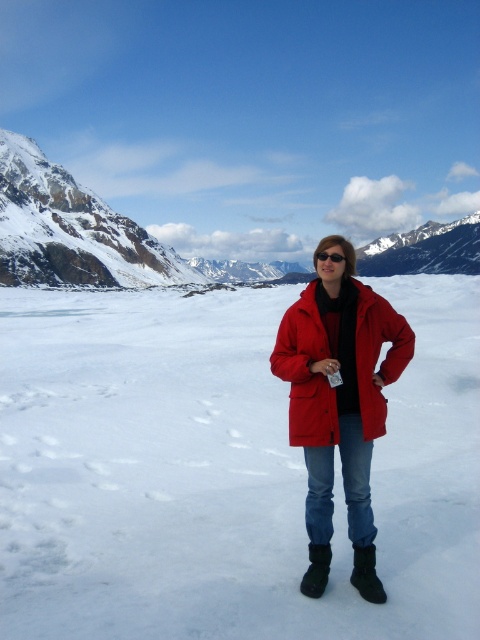
Does snowy rocky mountain at upper left lie behind red plastic sunglasses at center?

Yes, it is behind red plastic sunglasses at center.

Where is `snowy rocky mountain at upper left`? snowy rocky mountain at upper left is located at coordinates (71, 228).

Identify the location of snowy rocky mountain at upper left. This screenshot has width=480, height=640. (71, 228).

From the picture: Between white matte snow at center and matte red jacket at center, which one appears on the right side from the viewer's perspective?

matte red jacket at center is more to the right.

Can you confirm if white matte snow at center is bigger than matte red jacket at center?

Correct, white matte snow at center is larger in size than matte red jacket at center.

Which is in front, point (264, 616) or point (283, 320)?

Point (264, 616)

Image resolution: width=480 pixels, height=640 pixels. What are the coordinates of `white matte snow at center` in the screenshot? It's located at point(222,472).

Does point (13, 310) come in front of point (336, 438)?

No, (13, 310) is further to viewer.

Can you confirm if white matte snow at center is wider than matte red coat at center?

Yes.

Identify the location of white matte snow at center. Image resolution: width=480 pixels, height=640 pixels. (222, 472).